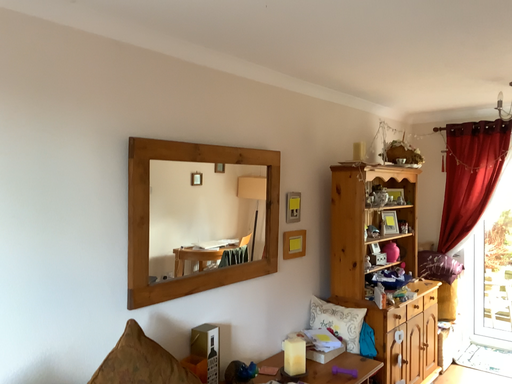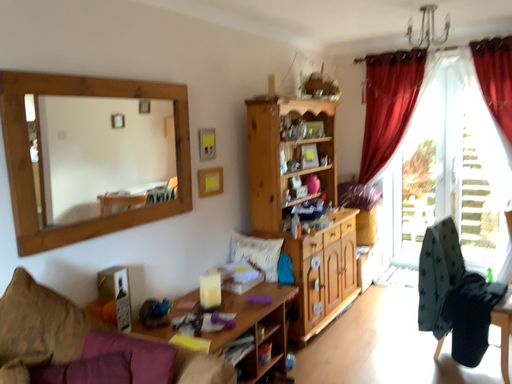
Question: Which way did the camera rotate in the video?

Choices:
 (A) rotated left
 (B) rotated right

Answer: (B)